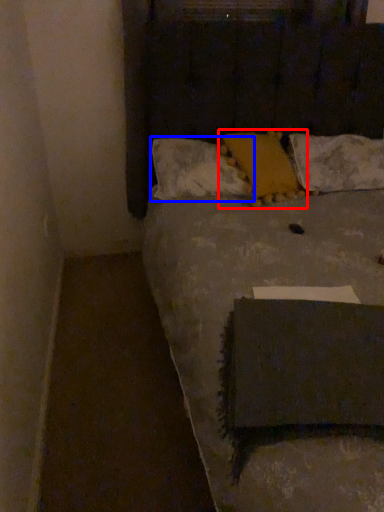
Question: Which object is further to the camera taking this photo, pillow (highlighted by a red box) or pillow (highlighted by a blue box)?

Choices:
 (A) pillow
 (B) pillow

Answer: (B)